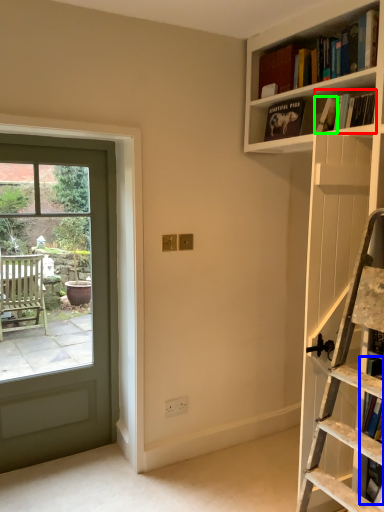
Question: Which is farther away from book (highlighted by a red box)? book (highlighted by a blue box) or book (highlighted by a green box)?

Choices:
 (A) book
 (B) book

Answer: (A)